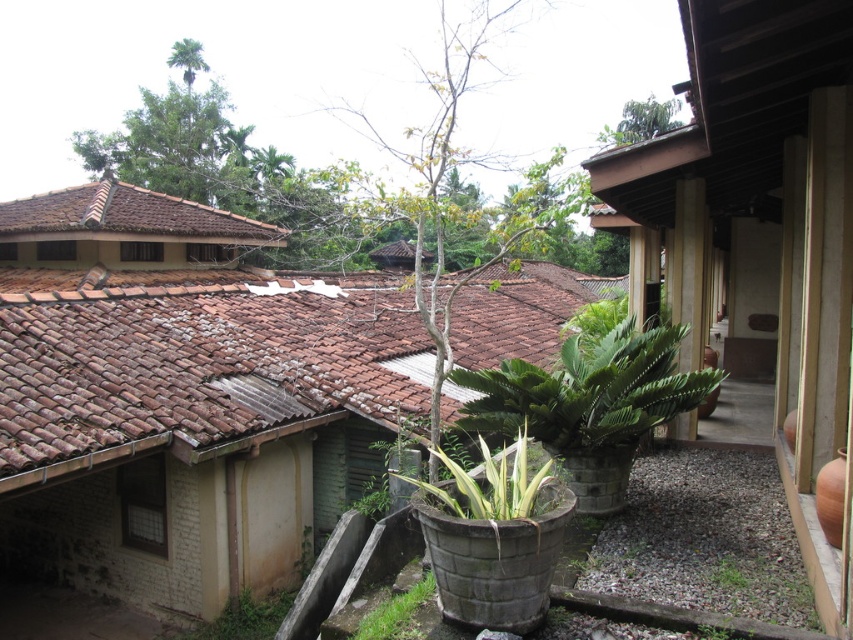
Question: Which object is positioned closest to the green leafy tree at center?

Choices:
 (A) green leafy tree at upper center
 (B) brown clay tiles at upper left

Answer: (B)

Question: In this image, where is brown clay tiles at upper left located relative to green leafy tree at center?

Choices:
 (A) right
 (B) left

Answer: (A)

Question: Which of the following is the closest to the observer?

Choices:
 (A) (202, 280)
 (B) (437, 461)
 (C) (654, 125)

Answer: (B)

Question: Which object appears closest to the camera in this image?

Choices:
 (A) green leafy tree at center
 (B) brown clay tiles at upper left

Answer: (B)

Question: Is brown clay tiles at upper left wider than green leafy tree at center?

Choices:
 (A) no
 (B) yes

Answer: (B)

Question: Is brown clay tiles at upper left further to camera compared to green leafy tree at upper center?

Choices:
 (A) no
 (B) yes

Answer: (A)